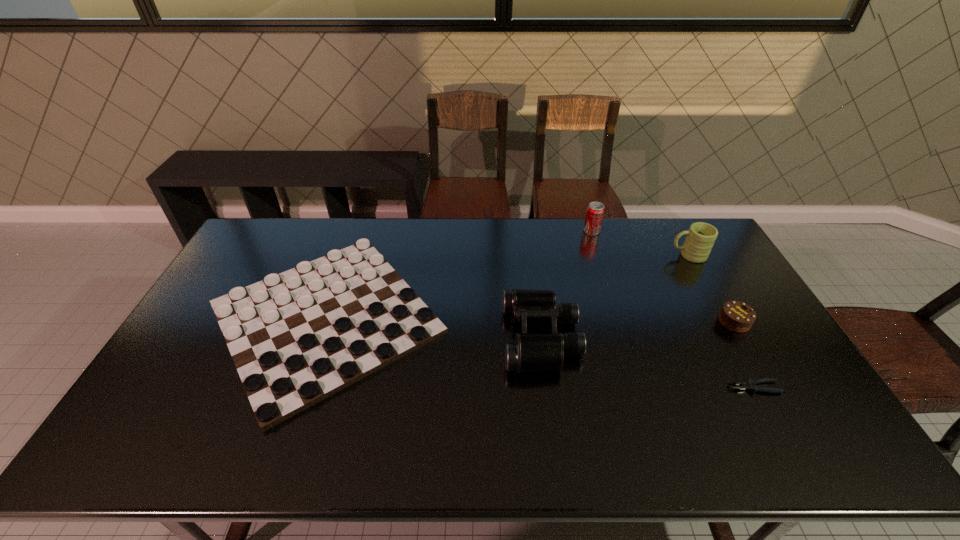
The height and width of the screenshot is (540, 960). Identify the location of vacant point located between the soda can and the chocolate cake. (662, 276).

Locate an element on the screen. The image size is (960, 540). vacant point located between the chocolate cake and the pliers is located at coordinates (744, 354).

Locate an element on the screen. empty space between the fifth tallest object and the mug is located at coordinates (507, 287).

I want to click on free spot between the third shortest object and the farthest object, so click(x=662, y=276).

Identify which object is located as the fifth nearest to the gameboard. Please provide its 2D coordinates. Your answer should be formatted as a tuple, i.e. [(x, y)], where the tuple contains the x and y coordinates of a point satisfying the conditions above.

[(736, 316)]

Locate an element on the screen. The height and width of the screenshot is (540, 960). object that is the closest one to the mug is located at coordinates (595, 211).

Locate an element on the screen. This screenshot has width=960, height=540. vacant point that satisfies the following two spatial constraints: 1. on the side of the mug with the handle; 2. on the left side of the third shortest object is located at coordinates (725, 322).